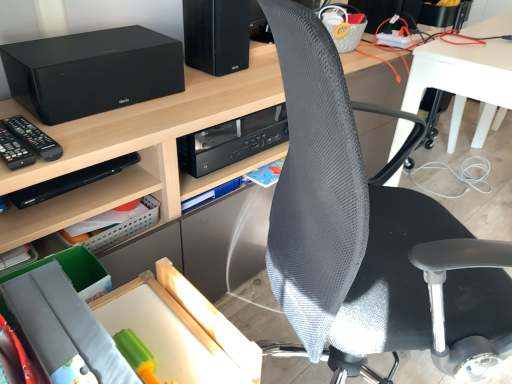
Question: From the image's perspective, is black matte speaker at upper left on black mesh chair at center?

Choices:
 (A) no
 (B) yes

Answer: (B)

Question: From the image's perspective, would you say black matte speaker at upper left is shown under black mesh chair at center?

Choices:
 (A) yes
 (B) no

Answer: (B)

Question: Can you see black matte speaker at upper left touching black mesh chair at center?

Choices:
 (A) no
 (B) yes

Answer: (A)

Question: Is black mesh chair at center surrounded by black matte speaker at upper left?

Choices:
 (A) no
 (B) yes

Answer: (A)

Question: Is black matte speaker at upper left oriented towards black mesh chair at center?

Choices:
 (A) yes
 (B) no

Answer: (A)

Question: Visually, is black mesh chair at center positioned to the left or to the right of black matte computer tower at upper center?

Choices:
 (A) left
 (B) right

Answer: (B)

Question: Is black mesh chair at center bigger or smaller than black matte computer tower at upper center?

Choices:
 (A) small
 (B) big

Answer: (B)

Question: Does point (444, 281) appear closer or farther from the camera than point (183, 23)?

Choices:
 (A) farther
 (B) closer

Answer: (B)

Question: From the image's perspective, is black mesh chair at center positioned above or below black matte computer tower at upper center?

Choices:
 (A) below
 (B) above

Answer: (A)

Question: Does point (95, 213) appear closer or farther from the camera than point (200, 56)?

Choices:
 (A) farther
 (B) closer

Answer: (B)

Question: From a real-world perspective, is black plastic shelf at lower left positioned above or below black matte computer tower at upper center?

Choices:
 (A) below
 (B) above

Answer: (A)

Question: Is black plastic shelf at lower left wider or thinner than black matte computer tower at upper center?

Choices:
 (A) thin
 (B) wide

Answer: (A)

Question: In terms of size, does black plastic shelf at lower left appear bigger or smaller than black matte computer tower at upper center?

Choices:
 (A) big
 (B) small

Answer: (B)

Question: Is black plastic remote control at left in front of or behind black mesh chair at center in the image?

Choices:
 (A) behind
 (B) front

Answer: (A)

Question: In the image, is black plastic remote control at left on the left side or the right side of black mesh chair at center?

Choices:
 (A) right
 (B) left

Answer: (B)